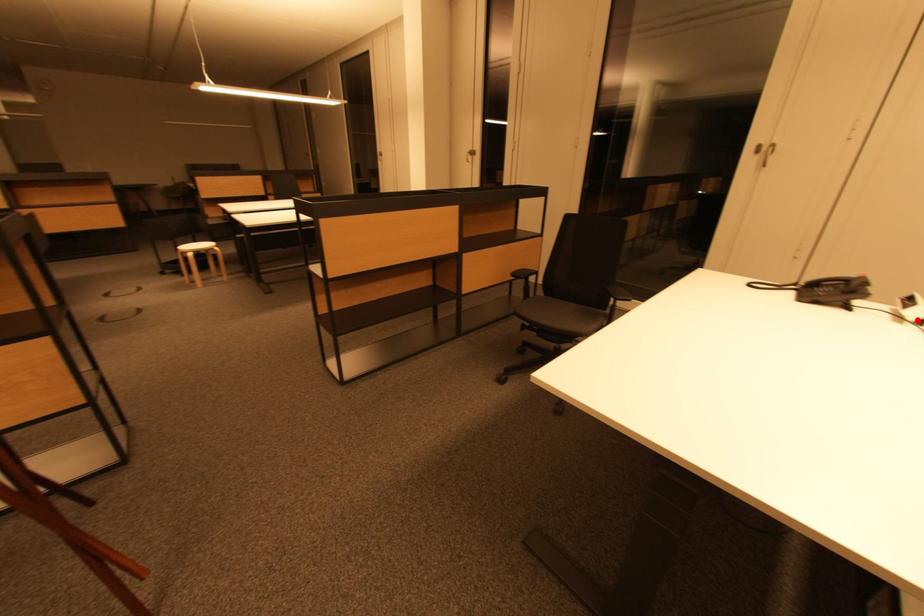
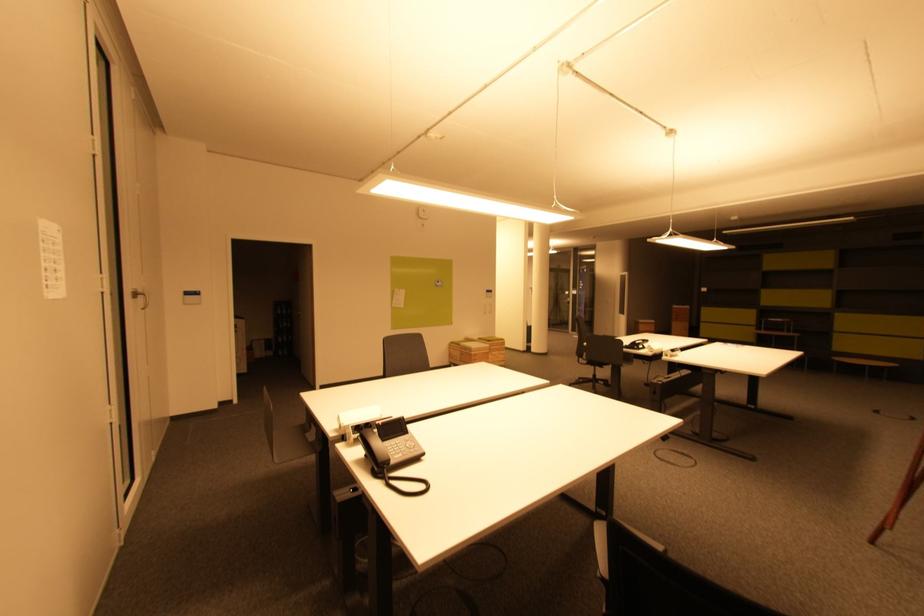
Question: I am providing you with two images of the same scene from different viewpoints. A red point is marked on the first image. Can you still see the location of the red point in image 2?

Choices:
 (A) Yes
 (B) No

Answer: (B)